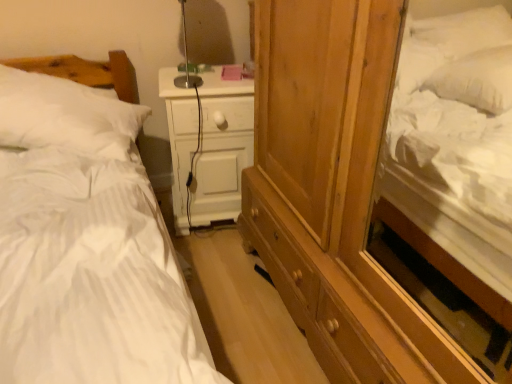
Question: Is white matte nightstand at center smaller than white soft pillow at left?

Choices:
 (A) yes
 (B) no

Answer: (A)

Question: Does white matte nightstand at center have a greater width compared to white soft pillow at left?

Choices:
 (A) no
 (B) yes

Answer: (A)

Question: Is white matte nightstand at center not inside white soft pillow at left?

Choices:
 (A) yes
 (B) no

Answer: (A)

Question: Is white matte nightstand at center in front of white soft pillow at left?

Choices:
 (A) no
 (B) yes

Answer: (A)

Question: Are white matte nightstand at center and white soft pillow at left beside each other?

Choices:
 (A) no
 (B) yes

Answer: (A)

Question: From a real-world perspective, is white matte nightstand at center on white soft pillow at left?

Choices:
 (A) yes
 (B) no

Answer: (B)

Question: From the image's perspective, is white striped fabric bed at left on white soft pillow at left?

Choices:
 (A) no
 (B) yes

Answer: (A)

Question: From the image's perspective, does white striped fabric bed at left appear lower than white soft pillow at left?

Choices:
 (A) no
 (B) yes

Answer: (B)

Question: Can you confirm if white striped fabric bed at left is bigger than white soft pillow at left?

Choices:
 (A) yes
 (B) no

Answer: (A)

Question: Is white striped fabric bed at left aimed at white soft pillow at left?

Choices:
 (A) no
 (B) yes

Answer: (A)

Question: Does white striped fabric bed at left lie in front of white soft pillow at left?

Choices:
 (A) no
 (B) yes

Answer: (B)

Question: Is white striped fabric bed at left not near white soft pillow at left?

Choices:
 (A) no
 (B) yes

Answer: (A)

Question: Considering the relative sizes of white soft pillow at left and white matte nightstand at center in the image provided, is white soft pillow at left shorter than white matte nightstand at center?

Choices:
 (A) yes
 (B) no

Answer: (A)